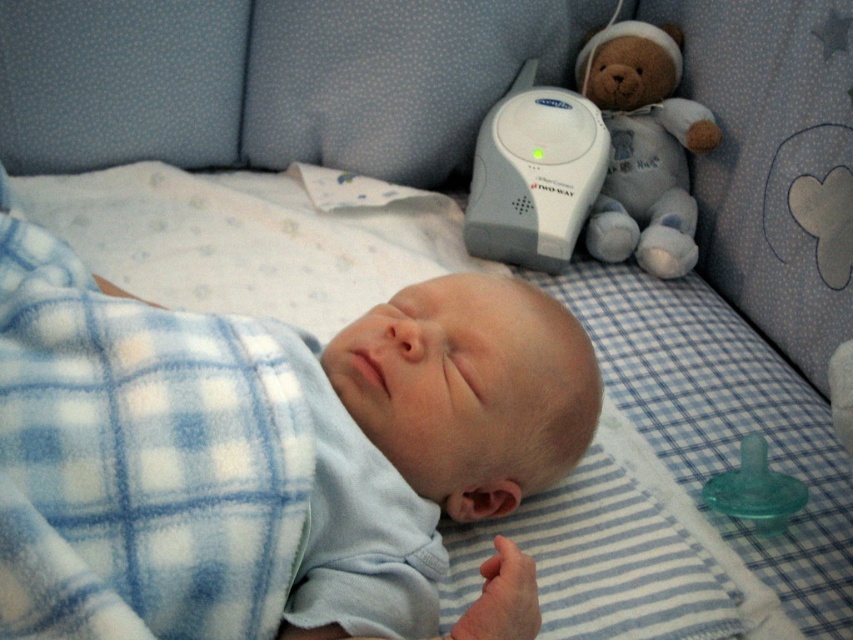
Question: Is blue fleece baby at center thinner than white plastic baby monitor at upper center?

Choices:
 (A) no
 (B) yes

Answer: (A)

Question: Estimate the real-world distances between objects in this image. Which object is closer to the soft plush teddy bear at upper right?

Choices:
 (A) green rubber pacifier at lower right
 (B) blue fleece baby at center

Answer: (A)

Question: Based on their relative distances, which object is farther from the soft plush teddy bear at upper right?

Choices:
 (A) green rubber pacifier at lower right
 (B) white plastic baby monitor at upper center

Answer: (A)

Question: Is blue fleece baby at center above white plastic baby monitor at upper center?

Choices:
 (A) yes
 (B) no

Answer: (B)

Question: Considering the relative positions of blue fleece baby at center and soft plush teddy bear at upper right in the image provided, where is blue fleece baby at center located with respect to soft plush teddy bear at upper right?

Choices:
 (A) right
 (B) left

Answer: (B)

Question: Estimate the real-world distances between objects in this image. Which object is closer to the white plastic baby monitor at upper center?

Choices:
 (A) soft plush teddy bear at upper right
 (B) blue fleece baby at center
 (C) green rubber pacifier at lower right

Answer: (A)